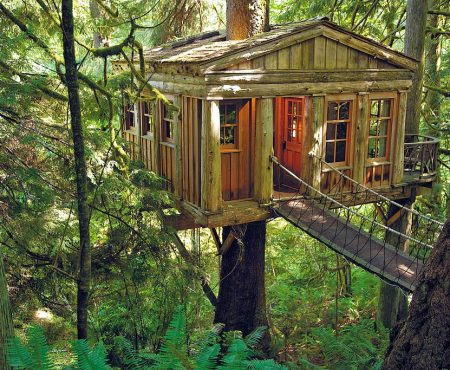
This screenshot has height=370, width=450. Identify the location of window frame. (337, 95).